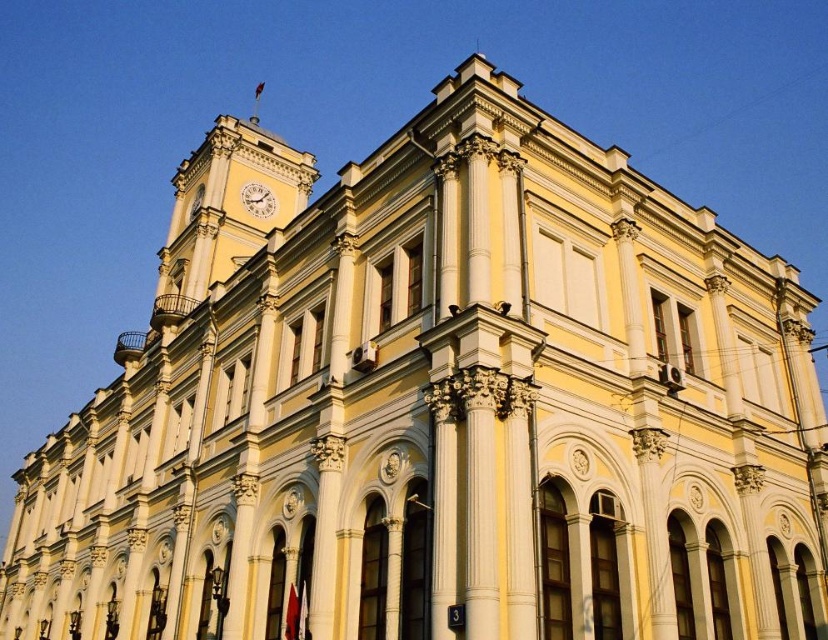
You are an architect examining the building from the front. You notice the yellow stone clock tower at upper left and the white glossy clock at upper center. Which of these two objects is positioned closer to your viewpoint?

The yellow stone clock tower at upper left is closer to the viewer than the white glossy clock at upper center.

You are an architect reviewing the building design. The yellow stone clock tower at upper left and the white glossy clock at upper center are both visible from the front entrance. Which one appears taller when viewed from the entrance?

The yellow stone clock tower at upper left appears taller than the white glossy clock at upper center because it is taller according to the design specifications.